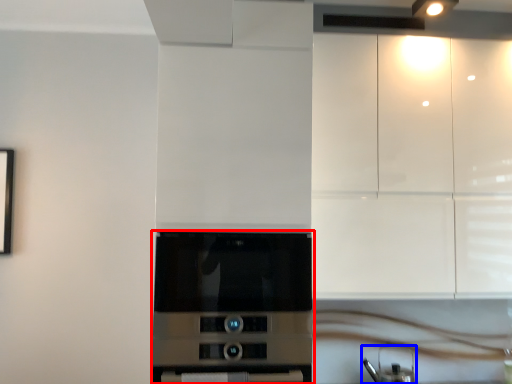
Question: Which object appears closest to the camera in this image, home appliance (highlighted by a red box) or appliance (highlighted by a blue box)?

Choices:
 (A) home appliance
 (B) appliance

Answer: (A)